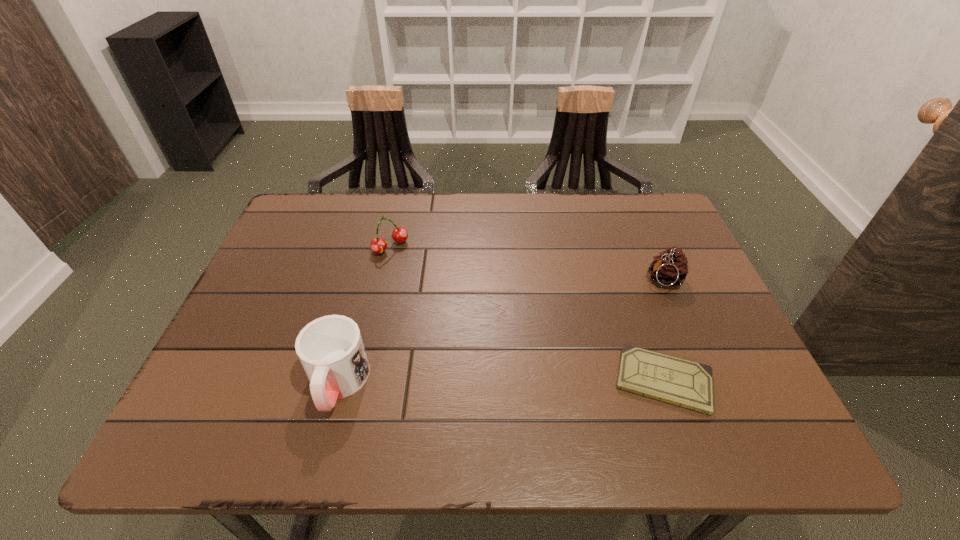
Find the location of `vacant space situated with stems pointing upwards on the farthest object`. vacant space situated with stems pointing upwards on the farthest object is located at coordinates (472, 323).

Locate an element on the screen. The image size is (960, 540). object at the far edge is located at coordinates (378, 245).

This screenshot has height=540, width=960. What are the coordinates of `mug present at the near edge` in the screenshot? It's located at (330, 349).

At what (x,y) coordinates should I click in order to perform the action: click on checkbook present at the near edge. Please return your answer as a coordinate pair (x, y). This screenshot has height=540, width=960. Looking at the image, I should click on coord(681,382).

In order to click on checkbook at the right edge in this screenshot , I will do `click(681, 382)`.

Identify the location of pinecone that is at the right edge. The height and width of the screenshot is (540, 960). (670, 268).

Where is `object present at the near right corner`? This screenshot has height=540, width=960. object present at the near right corner is located at coordinates (681, 382).

Locate an element on the screen. free region at the far edge of the desktop is located at coordinates (525, 238).

I want to click on vacant region at the near edge, so click(540, 368).

In the image, there is a desktop. In order to click on blank space at the left edge in this screenshot , I will do `click(277, 249)`.